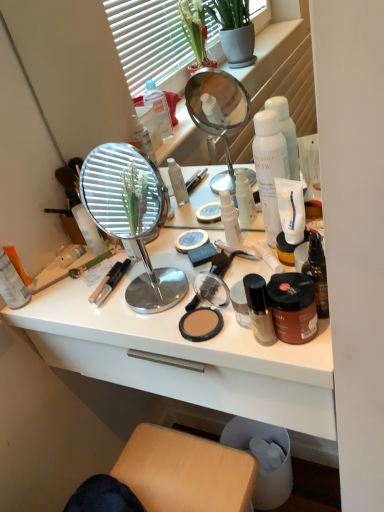
Where is `vacant space that's between matte black brush at lower left and shiny brown bottle at right, the 5th toiletry viewed from the left`? vacant space that's between matte black brush at lower left and shiny brown bottle at right, the 5th toiletry viewed from the left is located at coordinates (131, 284).